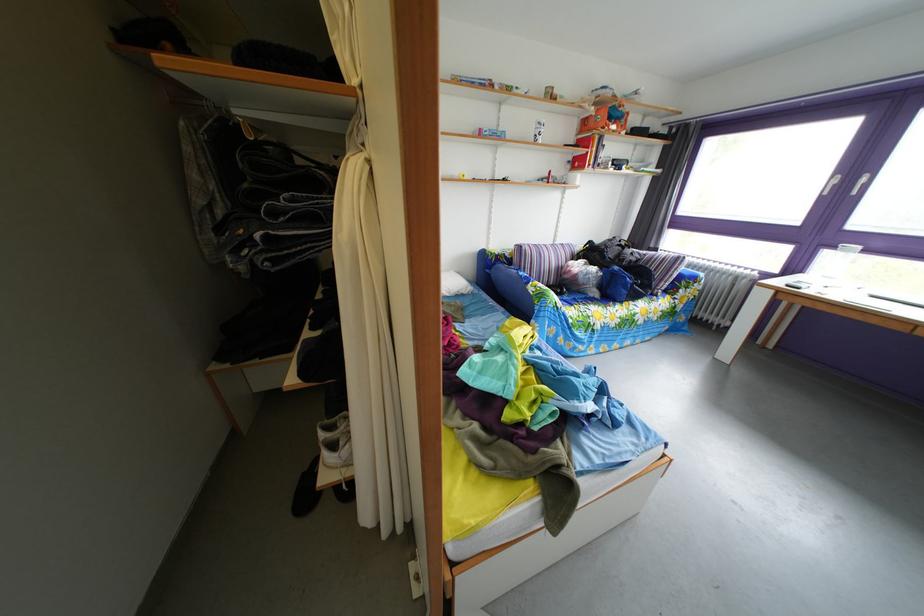
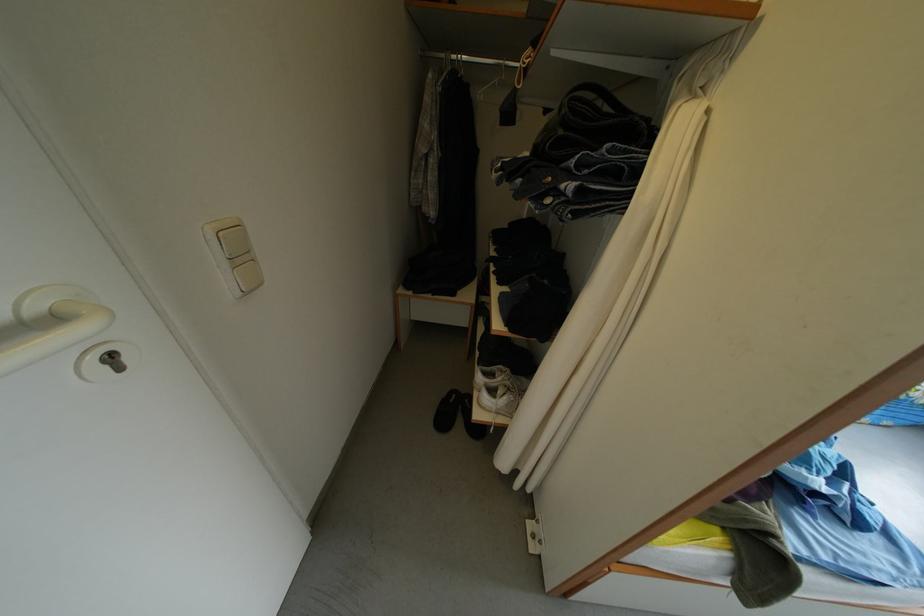
Find the pixel in the second image that matches (x=339, y=244) in the first image.

(639, 204)